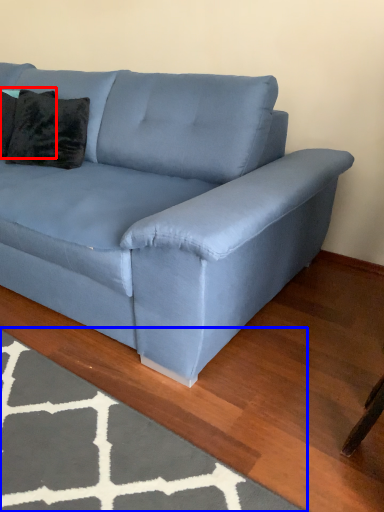
Question: Which object appears closest to the camera in this image, pillow (highlighted by a red box) or mat (highlighted by a blue box)?

Choices:
 (A) pillow
 (B) mat

Answer: (B)